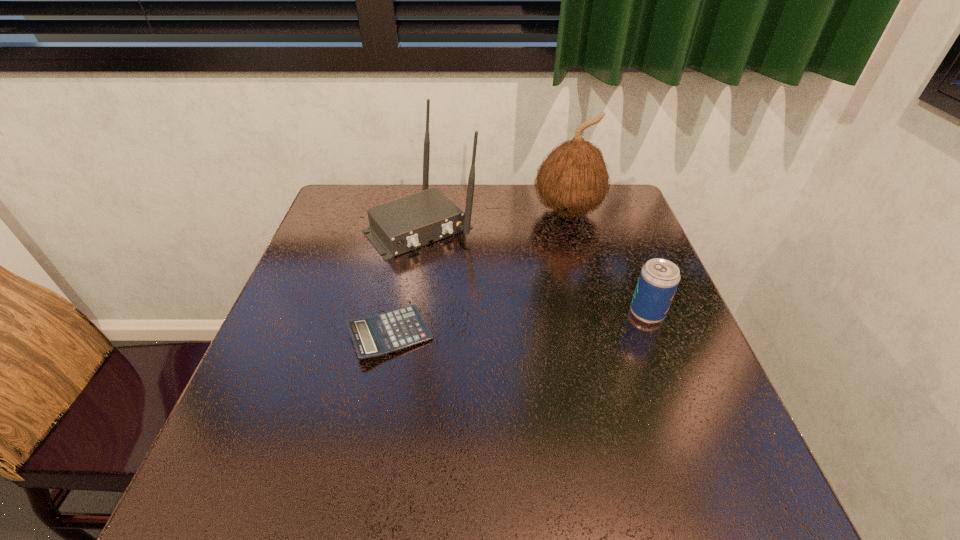
Identify the location of free spot between the calculator and the coconut. The width and height of the screenshot is (960, 540). (479, 273).

Where is `free area in between the router and the shortest object`? The width and height of the screenshot is (960, 540). free area in between the router and the shortest object is located at coordinates (406, 280).

Where is `vacant area that lies between the coconut and the router`? This screenshot has width=960, height=540. vacant area that lies between the coconut and the router is located at coordinates (494, 219).

Identify the location of empty space between the calculator and the router. The height and width of the screenshot is (540, 960). (406, 280).

Find the location of a particular element. The height and width of the screenshot is (540, 960). free spot between the beer can and the router is located at coordinates (534, 269).

The height and width of the screenshot is (540, 960). Identify the location of free space between the router and the coconut. (494, 219).

You are a GUI agent. You are given a task and a screenshot of the screen. Output one action in this format:
    pyautogui.click(x=<x>, y=<y>)
    Task: Click on the object that is the second nearest to the coconut
    
    Given the screenshot: What is the action you would take?
    pyautogui.click(x=659, y=278)

Select which object is the third closest to the beer can. Please provide its 2D coordinates. Your answer should be formatted as a tuple, i.e. [(x, y)], where the tuple contains the x and y coordinates of a point satisfying the conditions above.

[(381, 334)]

You are a GUI agent. You are given a task and a screenshot of the screen. Output one action in this format:
    pyautogui.click(x=<x>, y=<y>)
    Task: Click on the vacant point that satisfies the following two spatial constraints: 1. on the back side of the shortest object; 2. on the right side of the coconut
    
    Given the screenshot: What is the action you would take?
    pyautogui.click(x=415, y=212)

Image resolution: width=960 pixels, height=540 pixels. I want to click on free spot that satisfies the following two spatial constraints: 1. on the front side of the router; 2. on the left side of the third tallest object, so click(x=406, y=313).